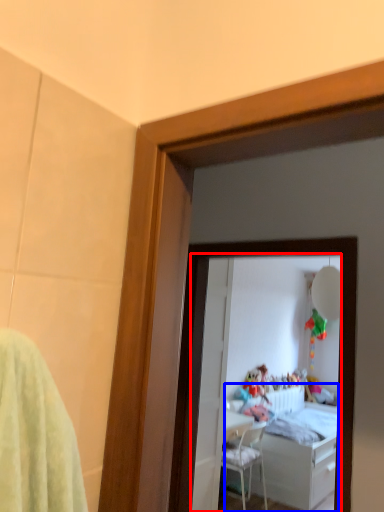
Question: Which object appears farthest to the camera in this image, mirror (highlighted by a red box) or bed (highlighted by a blue box)?

Choices:
 (A) mirror
 (B) bed

Answer: (B)